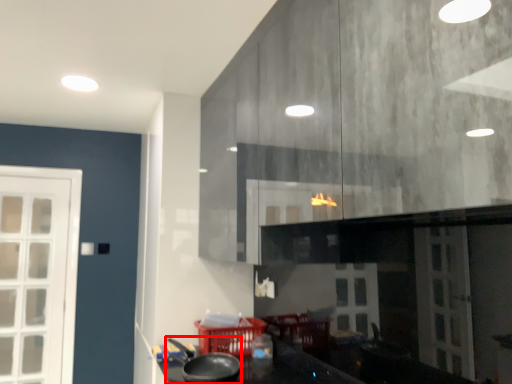
Question: From the image's perspective, what is the correct spatial positioning of wok (annotated by the red box) in reference to basket?

Choices:
 (A) below
 (B) above

Answer: (B)